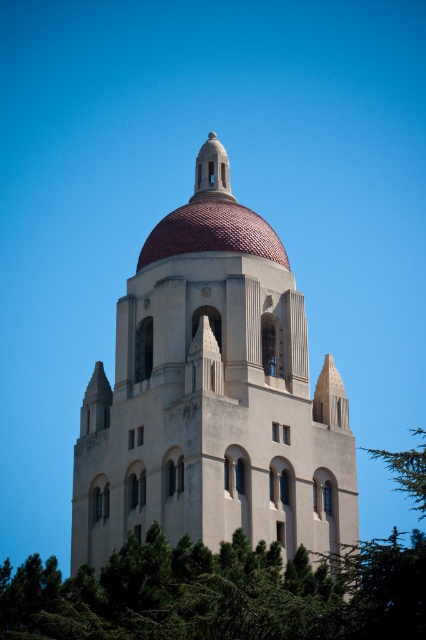
Is beige stone church at center smaller than terracotta tiled dome at center?

No, beige stone church at center is not smaller than terracotta tiled dome at center.

Which is above, beige stone church at center or terracotta tiled dome at center?

terracotta tiled dome at center is higher up.

Does point (328, 378) come behind point (201, 236)?

No, (328, 378) is in front of (201, 236).

Where is `beige stone church at center`? beige stone church at center is located at coordinates (213, 394).

Is green leafy tree at lower center positioned in front of terracotta tiled dome at center?

Yes, green leafy tree at lower center is closer to the viewer.

This screenshot has width=426, height=640. What do you see at coordinates (221, 593) in the screenshot? I see `green leafy tree at lower center` at bounding box center [221, 593].

Which is in front, point (319, 582) or point (173, 252)?

Point (319, 582) is more forward.

In order to click on green leafy tree at lower center in this screenshot , I will do `click(221, 593)`.

Can you confirm if beige stone church at center is wider than green leafy tree at lower center?

No, beige stone church at center is not wider than green leafy tree at lower center.

The height and width of the screenshot is (640, 426). What do you see at coordinates (213, 394) in the screenshot? I see `beige stone church at center` at bounding box center [213, 394].

This screenshot has width=426, height=640. Find the location of `beige stone church at center`. beige stone church at center is located at coordinates [x=213, y=394].